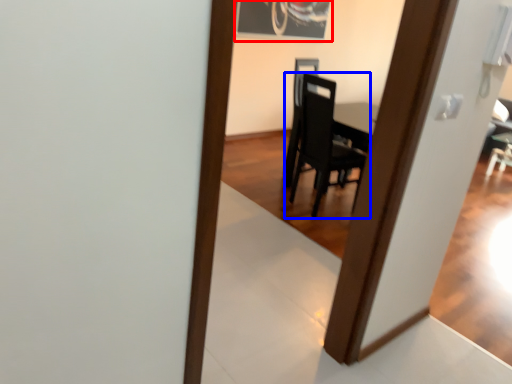
Question: Which of the following is the farthest to the observer, picture frame (highlighted by a red box) or chair (highlighted by a blue box)?

Choices:
 (A) picture frame
 (B) chair

Answer: (A)